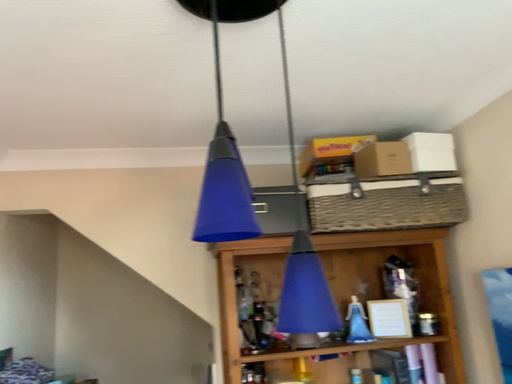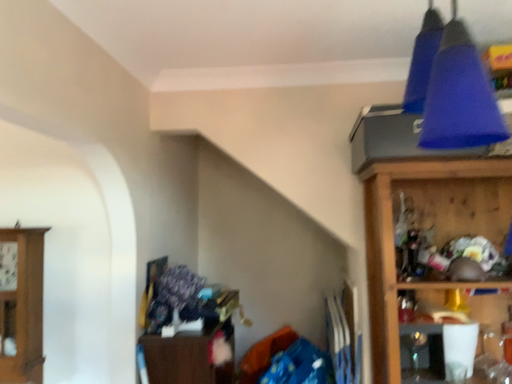
Question: How did the camera likely rotate when shooting the video?

Choices:
 (A) rotated upward
 (B) rotated downward

Answer: (B)